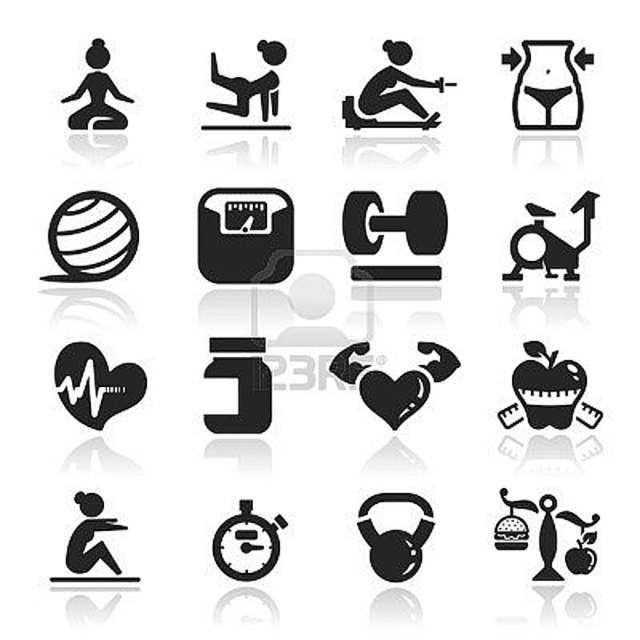
Question: Which point appears farthest from the camera in this image?

Choices:
 (A) (244, 115)
 (B) (525, 81)

Answer: (A)

Question: Which object is the closest to the black matte figure at center?

Choices:
 (A) black matte figure at upper left
 (B) transparent plastic waist at upper right
 (C) black rubber stopwatch at center

Answer: (A)

Question: Observing the image, what is the correct spatial positioning of black rubber stopwatch at center in reference to black matte exercise bike at upper right?

Choices:
 (A) right
 (B) left

Answer: (B)

Question: Which of the following is the farthest from the observer?

Choices:
 (A) [541, 118]
 (B) [428, 88]
 (C) [106, 531]

Answer: (B)

Question: Can you confirm if black heart at center is positioned to the right of black solid figure at center-left?

Choices:
 (A) no
 (B) yes

Answer: (A)

Question: Observing the image, what is the correct spatial positioning of transparent plastic waist at upper right in reference to black solid figure at center-left?

Choices:
 (A) above
 (B) below

Answer: (A)